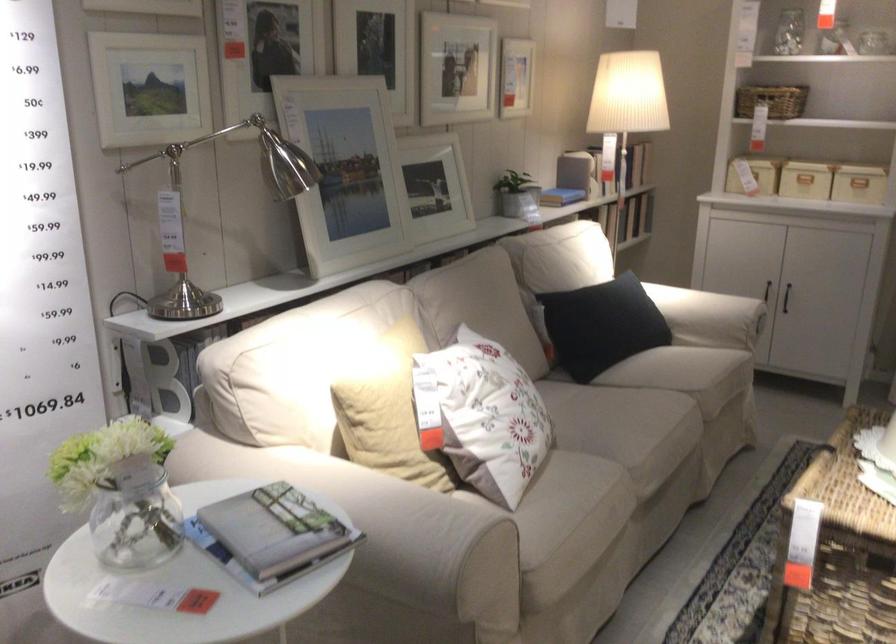
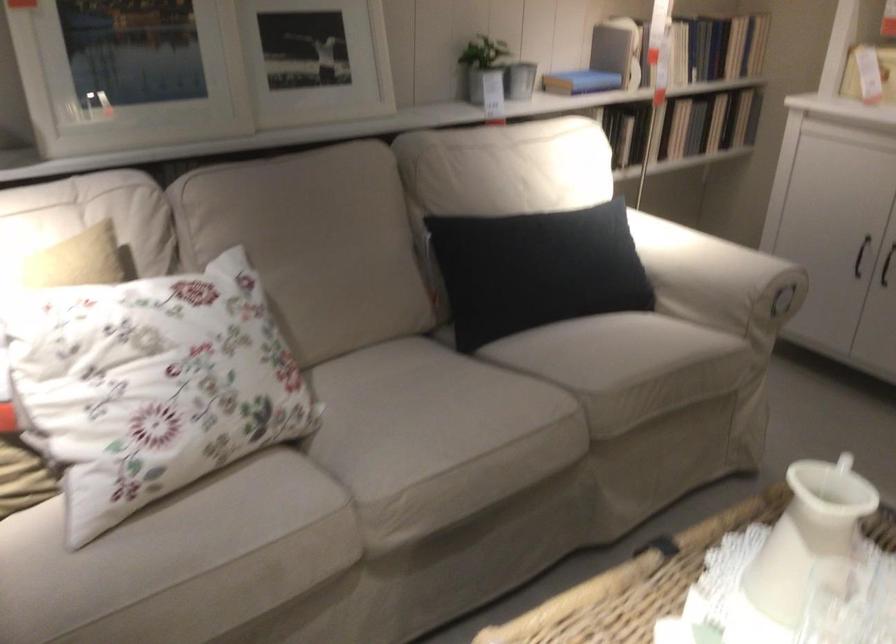
Find the pixel in the second image that matches point (506, 408) in the first image.

(150, 384)